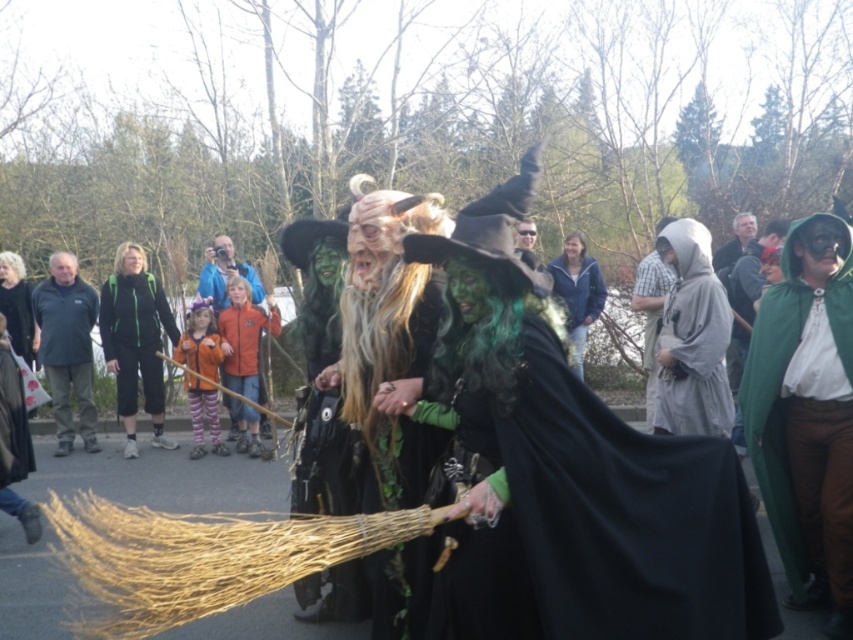
Question: Among these points, which one is farthest from the camera?

Choices:
 (A) (122, 307)
 (B) (73, 275)

Answer: (B)

Question: Which object is positioned closest to the gray fabric hood at right?

Choices:
 (A) green fleece jacket at left
 (B) dark green fleece jacket at left
 (C) blue fabric jacket at center
 (D) orange fleece jacket at center

Answer: (D)

Question: Can you confirm if dark green fleece jacket at left is positioned above blue fabric jacket at center?

Choices:
 (A) no
 (B) yes

Answer: (A)

Question: Among these points, which one is nearest to the camera?

Choices:
 (A) (239, 266)
 (B) (115, 336)
 (C) (228, 381)

Answer: (B)

Question: Is green fleece jacket at left in front of orange fleece jacket at center?

Choices:
 (A) no
 (B) yes

Answer: (A)

Question: Can you confirm if gray fabric hood at right is positioned below dark green fleece jacket at left?

Choices:
 (A) yes
 (B) no

Answer: (B)